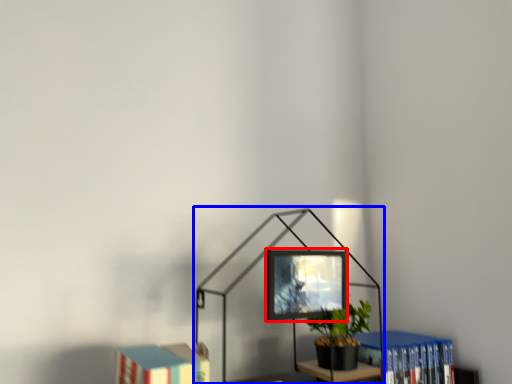
Question: Which object is further to the camera taking this photo, computer monitor (highlighted by a red box) or table lamp (highlighted by a blue box)?

Choices:
 (A) computer monitor
 (B) table lamp

Answer: (A)